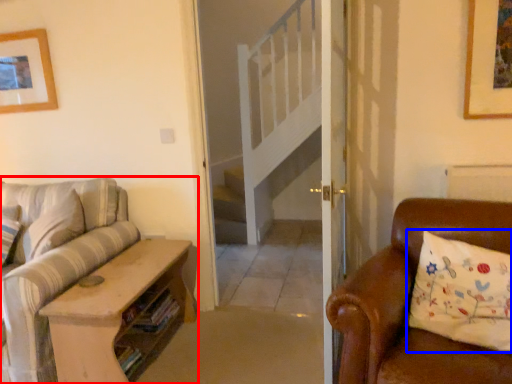
Question: Which of the following is the farthest to the observer, studio couch (highlighted by a red box) or pillow (highlighted by a blue box)?

Choices:
 (A) studio couch
 (B) pillow

Answer: (A)